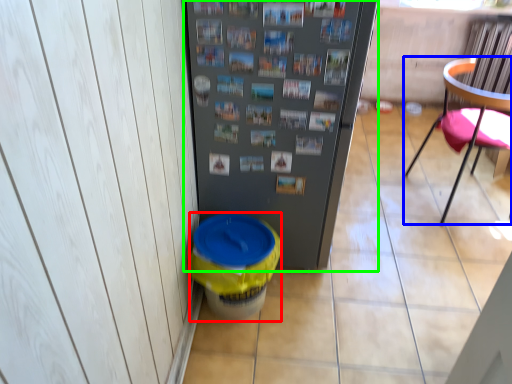
Question: Estimate the real-world distances between objects in this image. Which object is farther from potty (highlighted by a red box), chair (highlighted by a blue box) or refrigerator (highlighted by a green box)?

Choices:
 (A) chair
 (B) refrigerator

Answer: (A)